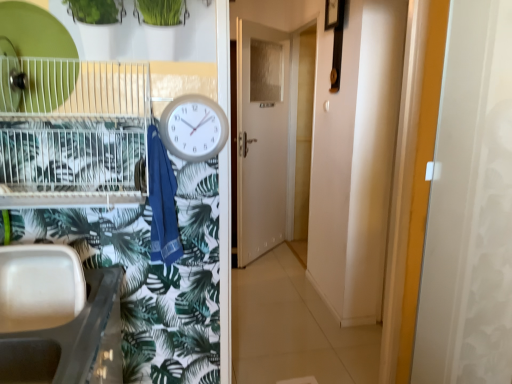
Question: From the image's perspective, is metallic wire birdcage at left above or below white glossy door at center?

Choices:
 (A) below
 (B) above

Answer: (A)

Question: Is metallic wire birdcage at left bigger or smaller than white glossy door at center?

Choices:
 (A) big
 (B) small

Answer: (B)

Question: Which is nearer to the white plastic sink at lower left?

Choices:
 (A) metallic wire birdcage at left
 (B) white glossy screen door at right
 (C) white plastic clock at center
 (D) white glossy door at center
 (E) blue cotton towel at center

Answer: (E)

Question: Which of these objects is positioned farthest from the white plastic sink at lower left?

Choices:
 (A) white plastic clock at center
 (B) blue cotton towel at center
 (C) white glossy door at center
 (D) white glossy screen door at right
 (E) metallic wire birdcage at left

Answer: (C)